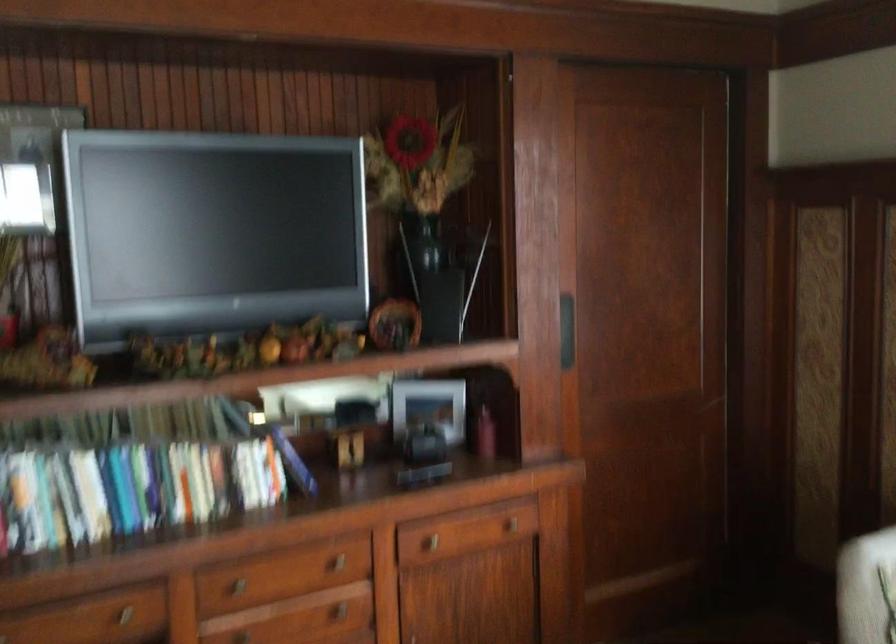
Find where to pull the brass cabinet pull. Please return your answer as a coordinate pair (x, y).

(237, 585)